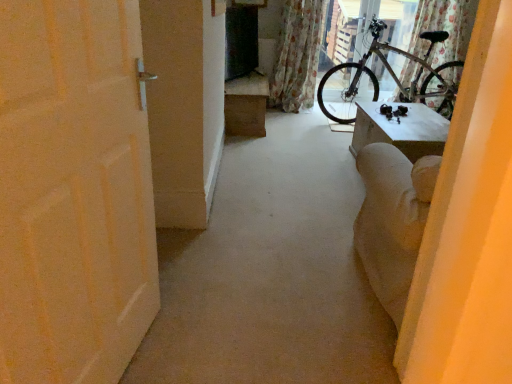
Question: Is silver metallic bicycle at upper right oriented away from floral fabric curtain at upper right, the 1th curtain viewed from the left?

Choices:
 (A) no
 (B) yes

Answer: (A)

Question: Would you say floral fabric curtain at upper right, the 1th curtain viewed from the left, is part of silver metallic bicycle at upper right's contents?

Choices:
 (A) no
 (B) yes

Answer: (A)

Question: Is silver metallic bicycle at upper right wider than floral fabric curtain at upper right, which is counted as the 2th curtain, starting from the right?

Choices:
 (A) no
 (B) yes

Answer: (B)

Question: From a real-world perspective, is silver metallic bicycle at upper right positioned over floral fabric curtain at upper right, which is counted as the 2th curtain, starting from the right, based on gravity?

Choices:
 (A) no
 (B) yes

Answer: (A)

Question: Considering the relative sizes of silver metallic bicycle at upper right and floral fabric curtain at upper right, which is counted as the 2th curtain, starting from the right, in the image provided, is silver metallic bicycle at upper right thinner than floral fabric curtain at upper right, which is counted as the 2th curtain, starting from the right,?

Choices:
 (A) yes
 (B) no

Answer: (B)

Question: Considering the positions of brown cardboard box at center and white matte door at left in the image, is brown cardboard box at center wider or thinner than white matte door at left?

Choices:
 (A) wide
 (B) thin

Answer: (B)

Question: Choose the correct answer: Is brown cardboard box at center inside white matte door at left or outside it?

Choices:
 (A) outside
 (B) inside

Answer: (A)

Question: Based on their sizes in the image, would you say brown cardboard box at center is bigger or smaller than white matte door at left?

Choices:
 (A) small
 (B) big

Answer: (A)

Question: From a real-world perspective, is brown cardboard box at center above or below white matte door at left?

Choices:
 (A) above
 (B) below

Answer: (A)

Question: In the image, is white matte door at left on the left side or the right side of silver metallic bicycle at upper right?

Choices:
 (A) left
 (B) right

Answer: (A)

Question: In terms of width, does white matte door at left look wider or thinner when compared to silver metallic bicycle at upper right?

Choices:
 (A) wide
 (B) thin

Answer: (B)

Question: From the image's perspective, is white matte door at left above or below silver metallic bicycle at upper right?

Choices:
 (A) below
 (B) above

Answer: (A)

Question: From a real-world perspective, is white matte door at left above or below silver metallic bicycle at upper right?

Choices:
 (A) below
 (B) above

Answer: (B)

Question: Is brown cardboard box at center to the left or to the right of silver metallic bicycle at upper right in the image?

Choices:
 (A) right
 (B) left

Answer: (B)

Question: Is brown cardboard box at center inside or outside of silver metallic bicycle at upper right?

Choices:
 (A) outside
 (B) inside

Answer: (A)